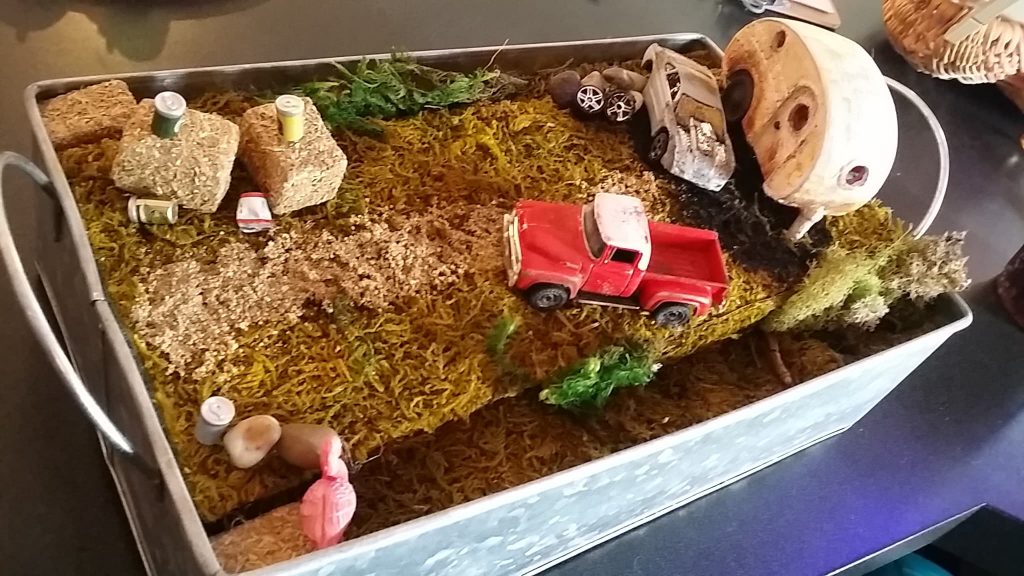
Where is `handle`? This screenshot has width=1024, height=576. handle is located at coordinates (940, 195), (24, 298).